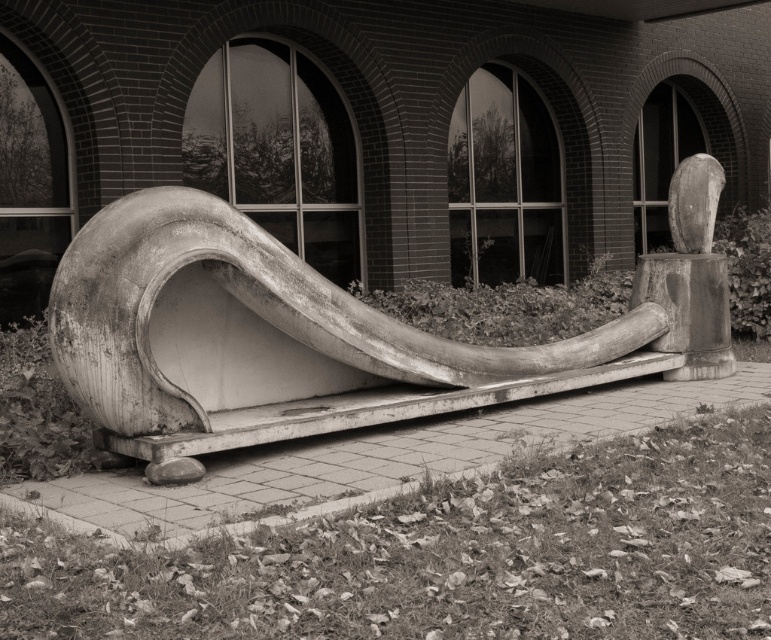
Question: Is smooth concrete slide at center above smooth wood sculpture at center?

Choices:
 (A) no
 (B) yes

Answer: (A)

Question: Is smooth concrete slide at center smaller than smooth wood sculpture at center?

Choices:
 (A) yes
 (B) no

Answer: (B)

Question: Can you confirm if smooth concrete slide at center is bigger than smooth wood sculpture at center?

Choices:
 (A) no
 (B) yes

Answer: (B)

Question: Which point is closer to the camera?

Choices:
 (A) (689, 326)
 (B) (125, 364)

Answer: (B)